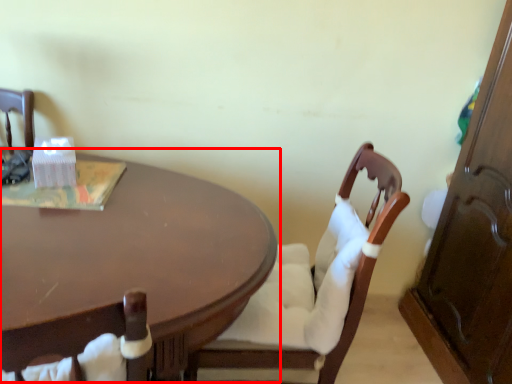
Question: In this image, where is coffee table (annotated by the red box) located relative to chair?

Choices:
 (A) left
 (B) right

Answer: (A)